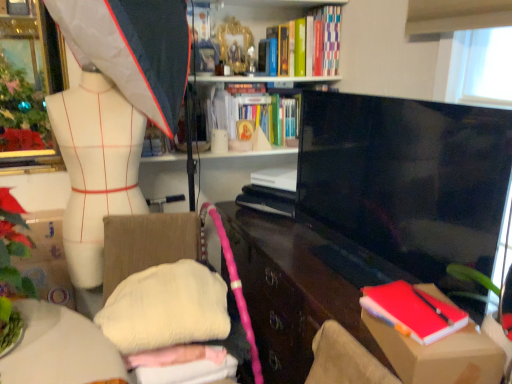
Question: Can you confirm if cardboard box at lower right is taller than hardcover book at upper center, positioned as the 1th book in back-to-front order?

Choices:
 (A) yes
 (B) no

Answer: (B)

Question: From a real-world perspective, is cardboard box at lower right located higher than hardcover book at upper center, positioned as the 1th book in back-to-front order?

Choices:
 (A) no
 (B) yes

Answer: (A)

Question: From the image's perspective, does cardboard box at lower right appear higher than hardcover book at upper center, positioned as the third book in front-to-back order?

Choices:
 (A) yes
 (B) no

Answer: (B)

Question: Does cardboard box at lower right appear on the right side of hardcover book at upper center, positioned as the 2th book in top-to-bottom order?

Choices:
 (A) yes
 (B) no

Answer: (A)

Question: Is cardboard box at lower right positioned beyond the bounds of hardcover book at upper center, positioned as the 2th book in top-to-bottom order?

Choices:
 (A) yes
 (B) no

Answer: (A)

Question: Is hardcover book at upper center, positioned as the 1th book in back-to-front order, inside cardboard box at lower right?

Choices:
 (A) yes
 (B) no

Answer: (B)

Question: Does hardcover book at upper center, positioned as the 1th book in back-to-front order, have a lesser height compared to white matte mannequin torso at left?

Choices:
 (A) yes
 (B) no

Answer: (A)

Question: Can you confirm if hardcover book at upper center, positioned as the 2th book in top-to-bottom order, is wider than white matte mannequin torso at left?

Choices:
 (A) no
 (B) yes

Answer: (B)

Question: Considering the relative positions of hardcover book at upper center, positioned as the 2th book in top-to-bottom order, and white matte mannequin torso at left in the image provided, is hardcover book at upper center, positioned as the 2th book in top-to-bottom order, to the left of white matte mannequin torso at left from the viewer's perspective?

Choices:
 (A) no
 (B) yes

Answer: (A)

Question: From the image's perspective, does hardcover book at upper center, which ranks as the 2th book in bottom-to-top order, appear lower than white matte mannequin torso at left?

Choices:
 (A) no
 (B) yes

Answer: (A)

Question: Is white matte mannequin torso at left located within hardcover book at upper center, positioned as the third book in front-to-back order?

Choices:
 (A) no
 (B) yes

Answer: (A)

Question: Considering the relative sizes of hardcover book at upper center, positioned as the 1th book in back-to-front order, and white matte mannequin torso at left in the image provided, is hardcover book at upper center, positioned as the 1th book in back-to-front order, smaller than white matte mannequin torso at left?

Choices:
 (A) yes
 (B) no

Answer: (A)

Question: Is white soft cushion at center positioned with its back to hardcover book at upper center, positioned as the 1th book in back-to-front order?

Choices:
 (A) no
 (B) yes

Answer: (A)